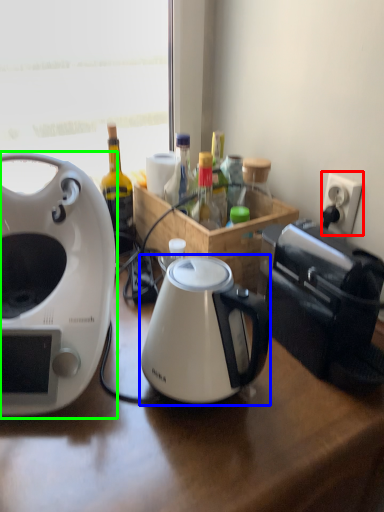
Question: Considering the real-world distances, which object is closest to power outlet (highlighted by a red box)? kettle (highlighted by a blue box) or coffee maker (highlighted by a green box).

Choices:
 (A) kettle
 (B) coffee maker

Answer: (A)